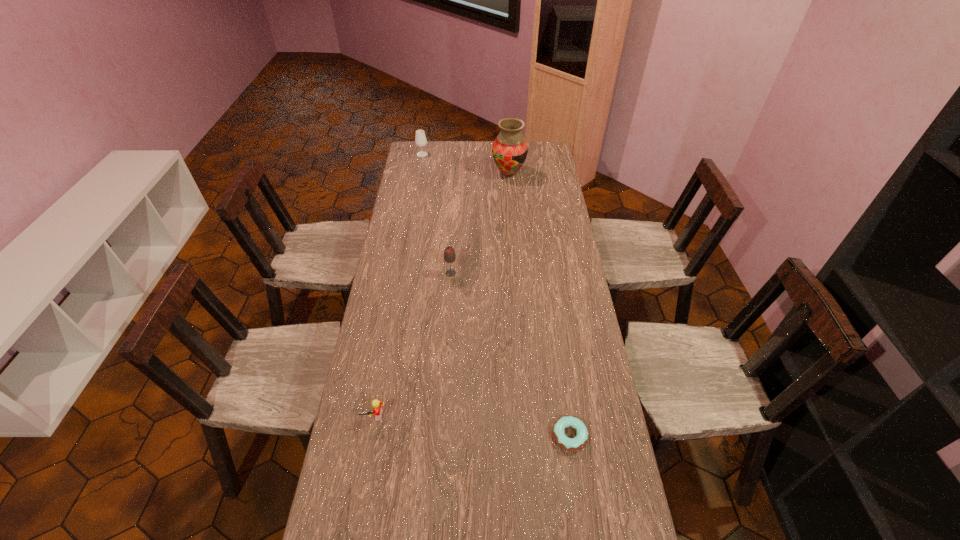
Locate an element on the screen. the fourth nearest object is located at coordinates (510, 149).

Locate an element on the screen. This screenshot has height=540, width=960. vase is located at coordinates (510, 149).

I want to click on the farther glass drink container, so click(x=420, y=139).

At what (x,y) coordinates should I click in order to perform the action: click on the farthest object. Please return your answer as a coordinate pair (x, y). The width and height of the screenshot is (960, 540). Looking at the image, I should click on (420, 139).

This screenshot has width=960, height=540. In order to click on the nearer glass drink container in this screenshot , I will do (449, 254).

Locate an element on the screen. the right glass drink container is located at coordinates (449, 254).

Where is `the fourth tallest object`? the fourth tallest object is located at coordinates (377, 409).

Find the location of `the shortest object`. the shortest object is located at coordinates (571, 444).

You are a GUI agent. You are given a task and a screenshot of the screen. Output one action in this format:
    pyautogui.click(x=<x>, y=<y>)
    Task: Click on the free location located on the left of the vase
    
    Given the screenshot: What is the action you would take?
    pyautogui.click(x=454, y=173)

Locate an element on the screen. This screenshot has height=540, width=960. vacant space situated 0.350m on the front of the farthest object is located at coordinates 415,197.